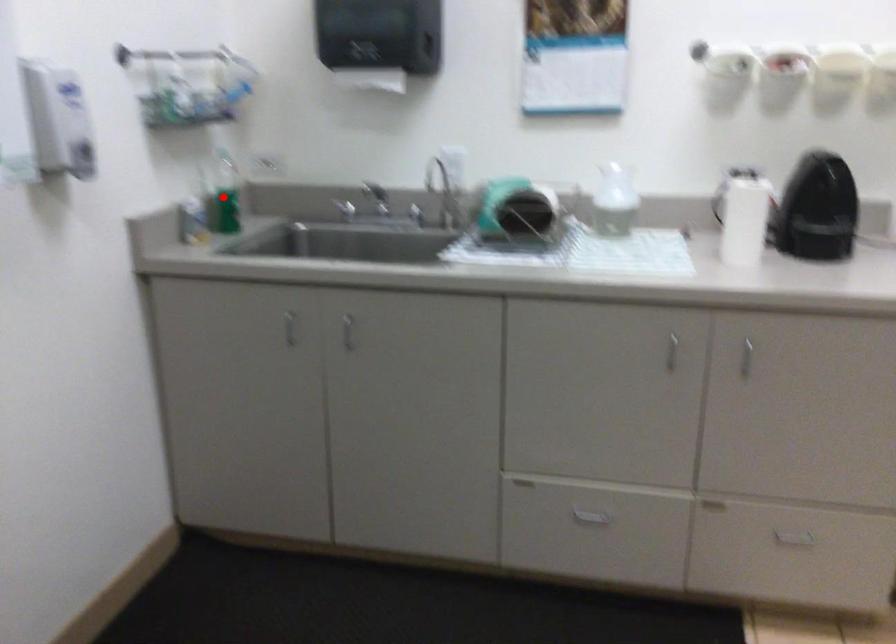
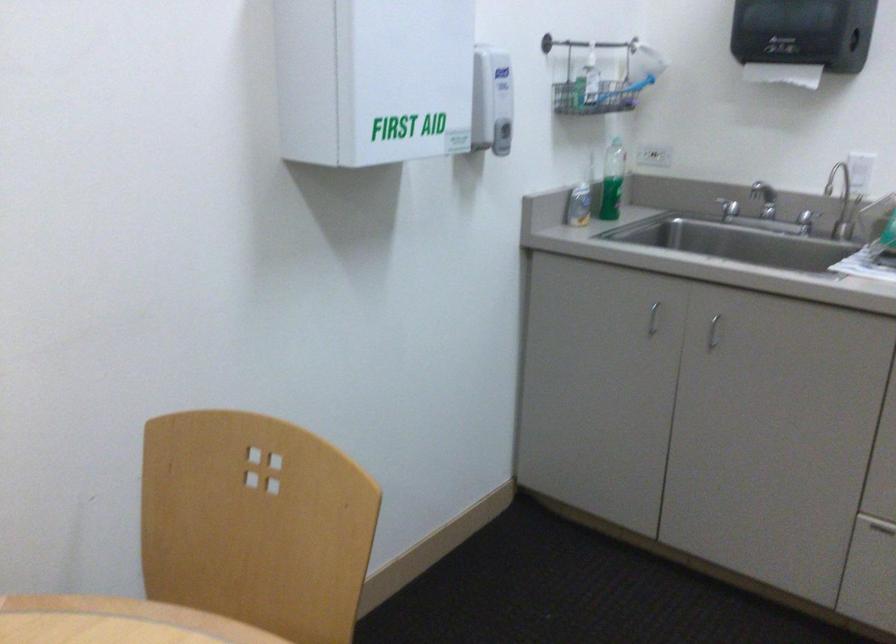
Question: I am providing you with two images of the same scene from different viewpoints. A red point is marked on the first image. At the location where the point appears in image 1, is it still visible in image 2?

Choices:
 (A) Yes
 (B) No

Answer: (A)